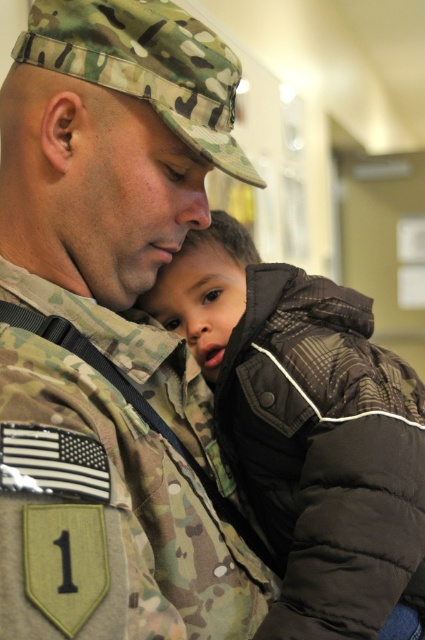
Question: Is camo uniform at center positioned behind brown quilted jacket at center?

Choices:
 (A) no
 (B) yes

Answer: (A)

Question: Which point is closer to the camera?

Choices:
 (A) camo uniform at center
 (B) brown quilted jacket at center

Answer: (A)

Question: Does camo uniform at center appear over brown quilted jacket at center?

Choices:
 (A) yes
 (B) no

Answer: (A)

Question: Which object is farther from the camera taking this photo?

Choices:
 (A) camo uniform at center
 (B) brown quilted jacket at center

Answer: (B)

Question: Which point is farther to the camera?

Choices:
 (A) camo uniform at center
 (B) brown quilted jacket at center

Answer: (B)

Question: Can you confirm if camo uniform at center is positioned to the right of brown quilted jacket at center?

Choices:
 (A) no
 (B) yes

Answer: (A)